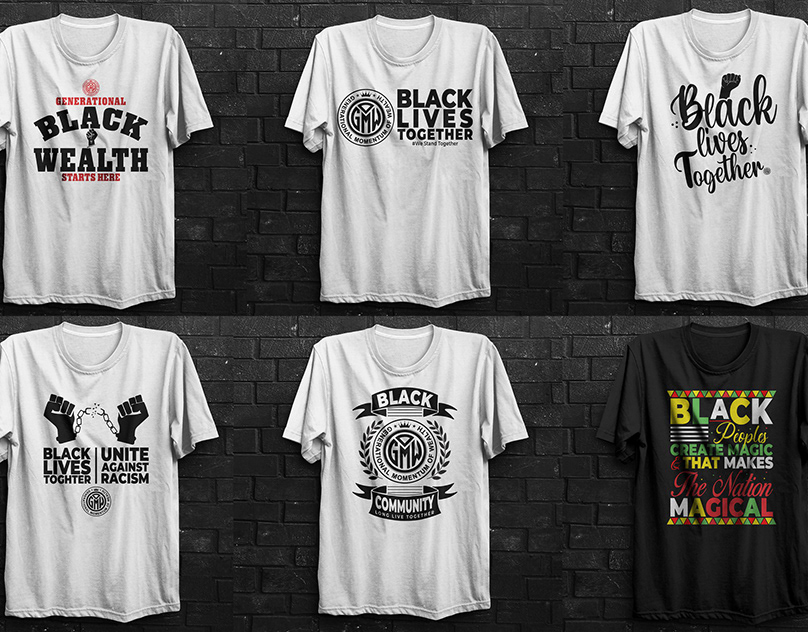
At what (x,y) coordinates should I click in order to perform the action: click on black bricks making up the wall. Please return your answer as a coordinate pair (x, y). Looking at the image, I should click on (250, 325), (217, 342), (278, 353), (246, 370), (237, 390).